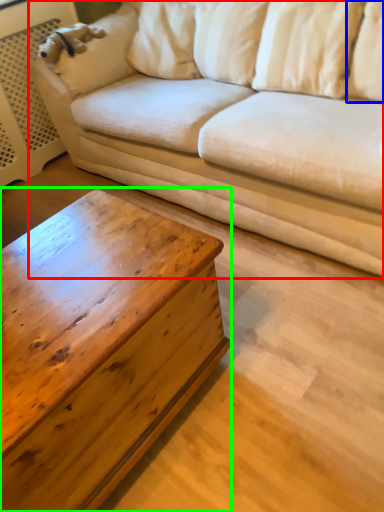
Question: Which object is positioned closest to studio couch (highlighted by a red box)? Select from pillow (highlighted by a blue box) and coffee table (highlighted by a green box).

Choices:
 (A) pillow
 (B) coffee table

Answer: (A)